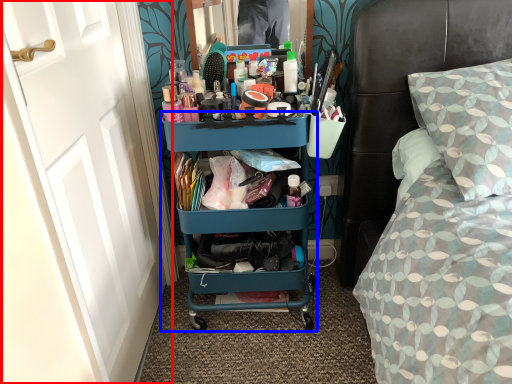
Question: Which point is further to the camera, door (highlighted by a red box) or shelf (highlighted by a blue box)?

Choices:
 (A) door
 (B) shelf

Answer: (B)